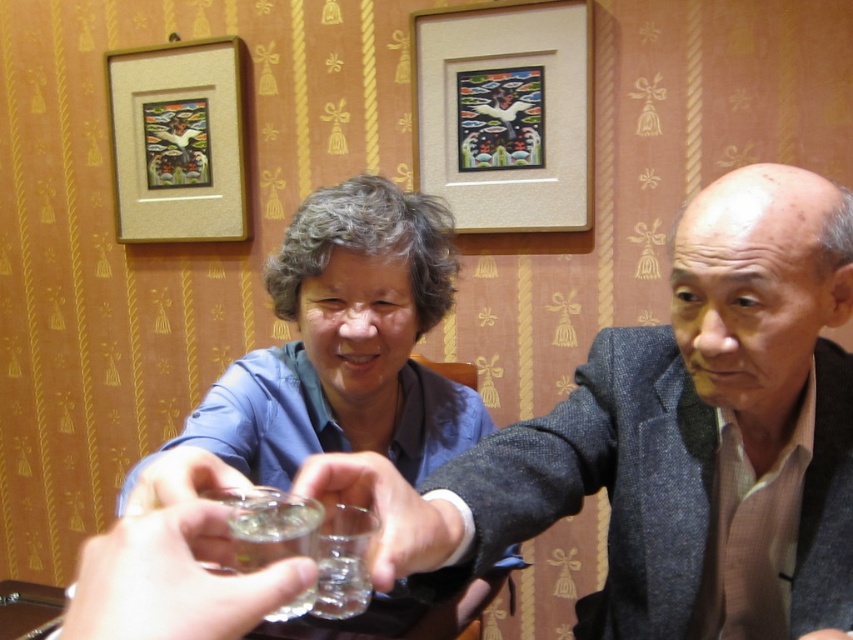
Question: Is gray wool suit at center to the right of wooden frame at upper center from the viewer's perspective?

Choices:
 (A) no
 (B) yes

Answer: (B)

Question: Which object is positioned farthest from the wooden frame at upper center?

Choices:
 (A) gray wool suit at center
 (B) clear glass at center

Answer: (B)

Question: Which object appears farthest from the camera in this image?

Choices:
 (A) wooden picture frame at upper left
 (B) blue fabric shirt at center
 (C) gray wool suit at center
 (D) wooden frame at upper center

Answer: (A)

Question: Is blue fabric shirt at center bigger than clear glass at center?

Choices:
 (A) yes
 (B) no

Answer: (A)

Question: Which object appears closest to the camera in this image?

Choices:
 (A) wooden frame at upper center
 (B) gray wool suit at center
 (C) clear glass at center
 (D) blue fabric shirt at center

Answer: (C)

Question: Can you confirm if blue fabric shirt at center is wider than wooden picture frame at upper left?

Choices:
 (A) no
 (B) yes

Answer: (B)